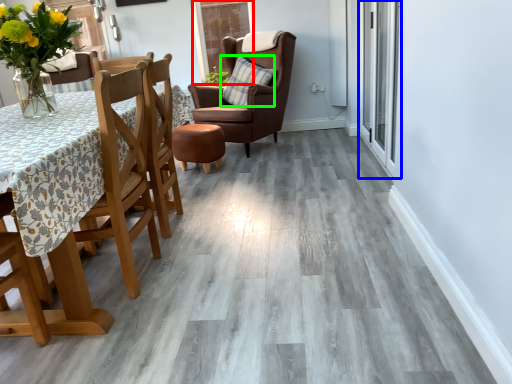
Question: Which object is the farthest from glass door (highlighted by a red box)? Choose among these: glass door (highlighted by a blue box) or pillow (highlighted by a green box).

Choices:
 (A) glass door
 (B) pillow

Answer: (A)